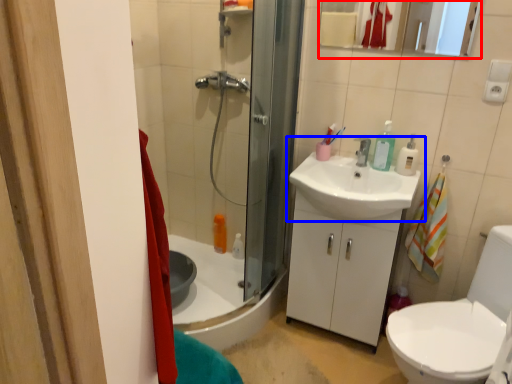
Question: Which of the following is the farthest to the observer, mirror (highlighted by a red box) or sink (highlighted by a blue box)?

Choices:
 (A) mirror
 (B) sink

Answer: (A)